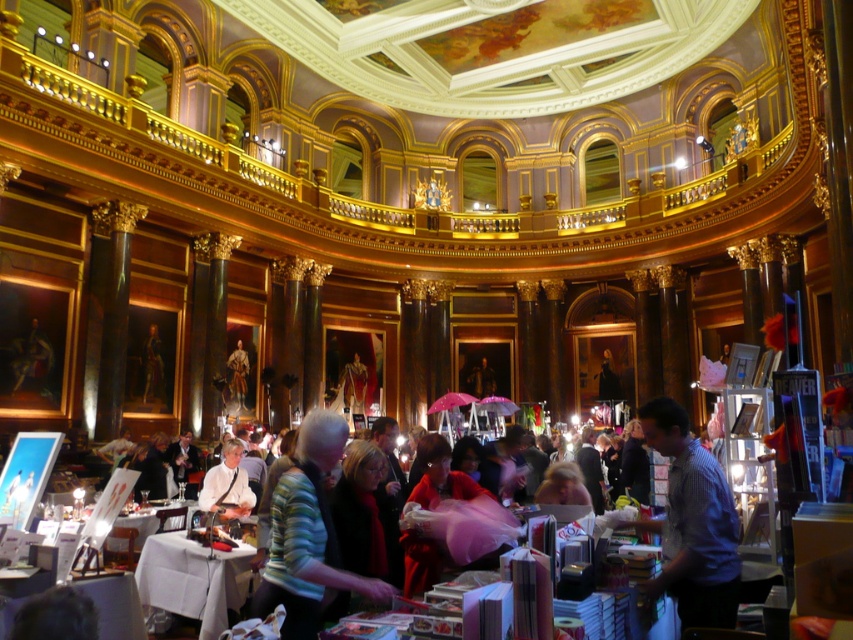
Question: Is blue checkered shirt at center below light blue shirt at center?

Choices:
 (A) yes
 (B) no

Answer: (B)

Question: Based on their relative distances, which object is nearer to the striped sweater at center?

Choices:
 (A) blue checkered shirt at center
 (B) red satin dress at center

Answer: (B)

Question: Which point appears farthest from the camera in this image?

Choices:
 (A) (693, 618)
 (B) (231, 467)
 (C) (184, 595)
 (D) (405, 586)

Answer: (B)

Question: Does blue checkered shirt at center appear over light blue shirt at center?

Choices:
 (A) no
 (B) yes

Answer: (B)

Question: Considering the relative positions of red satin dress at center and light blue shirt at center in the image provided, where is red satin dress at center located with respect to light blue shirt at center?

Choices:
 (A) left
 (B) right

Answer: (B)

Question: Which object appears farthest from the camera in this image?

Choices:
 (A) blue checkered shirt at center
 (B) light blue shirt at center

Answer: (B)